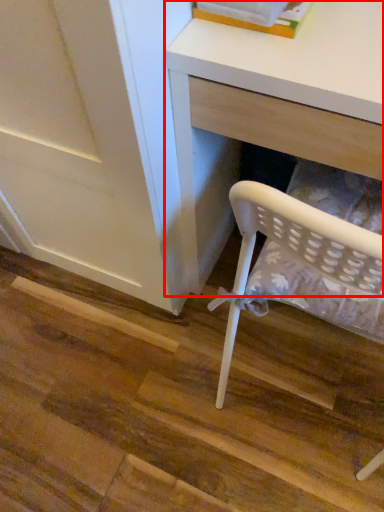
Question: From the image's perspective, considering the relative positions of desk (annotated by the red box) and book in the image provided, where is desk (annotated by the red box) located with respect to the staircase?

Choices:
 (A) below
 (B) above

Answer: (A)